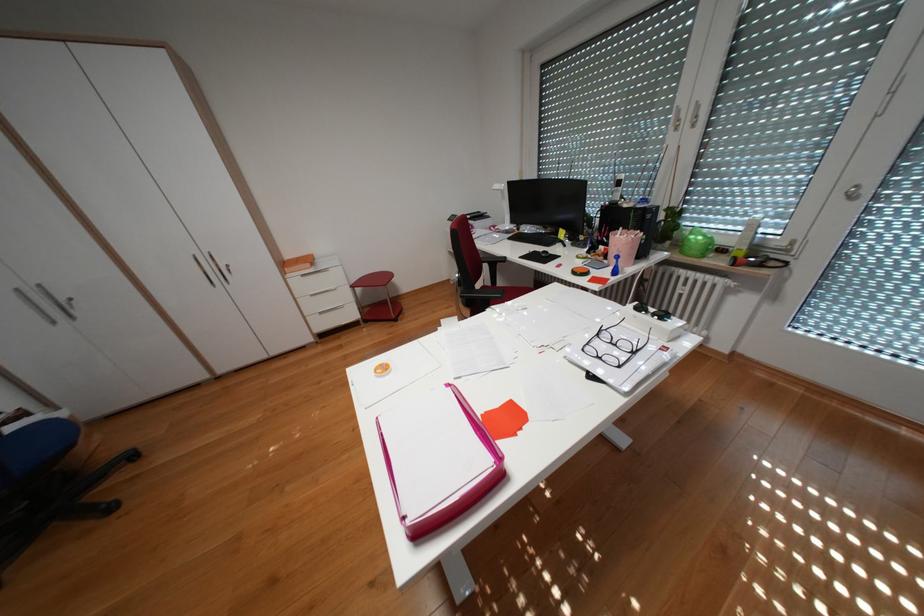
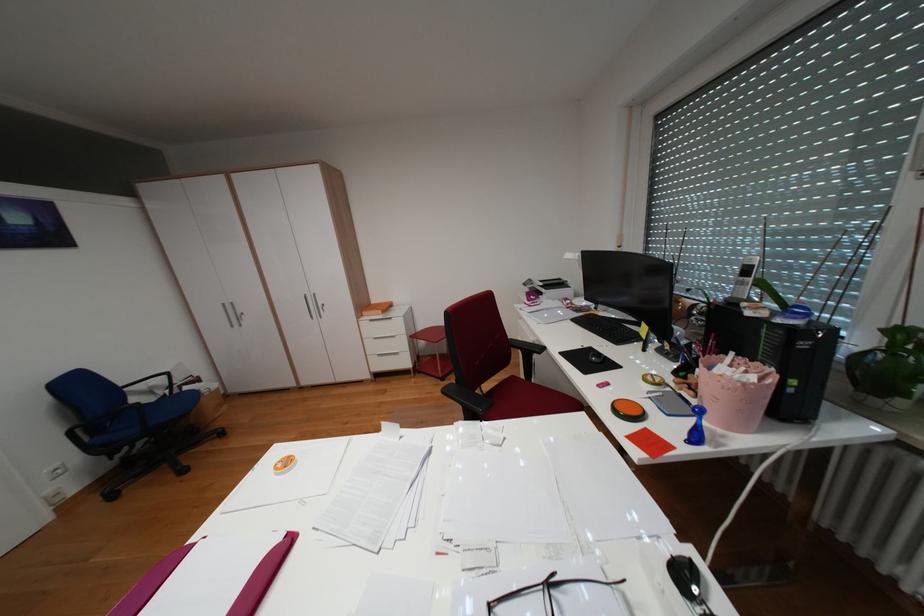
Question: How did the camera likely rotate?

Choices:
 (A) Left
 (B) Right
 (C) Up
 (D) Down

Answer: (A)